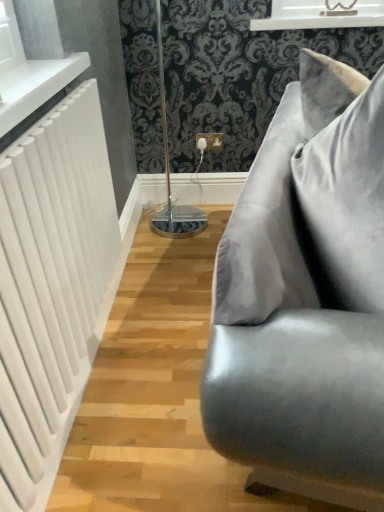
Identify the location of white glossy window frame at upper center. (321, 14).

The width and height of the screenshot is (384, 512). I want to click on white matte radiator at left, so click(x=53, y=276).

Find the location of `white glossy radiator at upper left`. white glossy radiator at upper left is located at coordinates (35, 86).

Locate an element on the screen. This screenshot has height=512, width=384. white glossy window frame at upper center is located at coordinates (321, 14).

Which object is further away from the camera taking this photo, white glossy window frame at upper center or satin gray couch at right?

white glossy window frame at upper center is further from the camera.

Which point is more forward, (313,22) or (296,269)?

The point (296,269) is closer.

From the image's perspective, is white glossy window frame at upper center over satin gray couch at right?

Yes.

What's the angular difference between white matte radiator at left and satin gray couch at right's facing directions?

The angular difference between white matte radiator at left and satin gray couch at right is 12.7 degrees.

From the picture: Does white matte radiator at left have a larger size compared to satin gray couch at right?

Actually, white matte radiator at left might be smaller than satin gray couch at right.

Considering the relative positions of white matte radiator at left and satin gray couch at right in the image provided, is white matte radiator at left to the left of satin gray couch at right from the viewer's perspective?

Yes.

From the image's perspective, which one is positioned lower, white matte radiator at left or satin gray couch at right?

satin gray couch at right.

Measure the distance from white matte radiator at left to white glossy radiator at upper left.

11.43 inches.

Considering the points (17, 194) and (32, 65), which point is behind, point (17, 194) or point (32, 65)?

The point (32, 65) is more distant.

Can you tell me how much white matte radiator at left and white glossy radiator at upper left differ in facing direction?

The angular difference between white matte radiator at left and white glossy radiator at upper left is 0.00133 degrees.

Does white matte radiator at left turn towards white glossy radiator at upper left?

No.

Is point (312, 156) positioned behind point (12, 111)?

No.

Which object is further away from the camera taking this photo, satin gray pillow at right or white glossy radiator at upper left?

white glossy radiator at upper left is behind.

Is satin gray pillow at right to the right of white glossy radiator at upper left from the viewer's perspective?

Correct, you'll find satin gray pillow at right to the right of white glossy radiator at upper left.

You are a GUI agent. You are given a task and a screenshot of the screen. Output one action in this format:
    pyautogui.click(x=<x>, y=<y>)
    Task: Click on the window sill lying above the satin gray pillow at right (from the image's perspective)
    
    Given the screenshot: What is the action you would take?
    (x=35, y=86)

From the image's perspective, which is above, satin gray couch at right or satin gray pillow at right?

satin gray pillow at right appears higher in the image.

Is satin gray couch at right touching satin gray pillow at right?

Indeed, satin gray couch at right and satin gray pillow at right are beside each other and touching.

Is satin gray couch at right wider than satin gray pillow at right?

Indeed, satin gray couch at right has a greater width compared to satin gray pillow at right.

Can you tell me how much satin gray pillow at right and white matte radiator at left differ in facing direction?

The facing directions of satin gray pillow at right and white matte radiator at left are 12.7 degrees apart.

Considering the relative positions of satin gray pillow at right and white matte radiator at left in the image provided, is satin gray pillow at right in front of white matte radiator at left?

No, satin gray pillow at right is further to the viewer.

The height and width of the screenshot is (512, 384). In order to click on pillow on the right of white matte radiator at left in this screenshot , I will do `click(344, 204)`.

From the image's perspective, between satin gray pillow at right and white matte radiator at left, which one is located above?

satin gray pillow at right is shown above in the image.

The width and height of the screenshot is (384, 512). Identify the location of studio couch to the right of satin gray pillow at right. (306, 298).

Do you think satin gray pillow at right is within satin gray couch at right, or outside of it?

satin gray pillow at right is contained in satin gray couch at right.

From the image's perspective, who appears lower, satin gray pillow at right or satin gray couch at right?

satin gray couch at right appears lower in the image.

Identify the location of studio couch below the white glossy window frame at upper center (from the image's perspective). This screenshot has width=384, height=512. (306, 298).

The width and height of the screenshot is (384, 512). What are the coordinates of `radiator lying behind the satin gray couch at right` in the screenshot? It's located at (53, 276).

Which object lies further to the anchor point white glossy radiator at upper left, white matte radiator at left or satin gray couch at right?

satin gray couch at right is positioned further to the anchor white glossy radiator at upper left.

Based on their spatial positions, is satin gray couch at right or white matte radiator at left further from white glossy radiator at upper left?

satin gray couch at right lies further to white glossy radiator at upper left than the other object.

Considering their positions, is satin gray pillow at right positioned further to satin gray couch at right than white glossy radiator at upper left?

Based on the image, white glossy radiator at upper left appears to be further to satin gray couch at right.

Which object lies nearer to the anchor point white glossy radiator at upper left, satin gray pillow at right or white glossy window frame at upper center?

satin gray pillow at right is positioned closer to the anchor white glossy radiator at upper left.

Which object lies nearer to the anchor point satin gray pillow at right, white glossy window frame at upper center or satin gray couch at right?

Based on the image, satin gray couch at right appears to be nearer to satin gray pillow at right.

Which object lies nearer to the anchor point white matte radiator at left, white glossy radiator at upper left or white glossy window frame at upper center?

white glossy radiator at upper left is positioned closer to the anchor white matte radiator at left.

From the image, which object appears to be farther from white matte radiator at left, satin gray pillow at right or satin gray couch at right?

satin gray pillow at right is further to white matte radiator at left.

When comparing their distances from white matte radiator at left, does satin gray pillow at right or white glossy window frame at upper center seem closer?

satin gray pillow at right is closer to white matte radiator at left.

Identify the location of window sill positioned between satin gray couch at right and white glossy window frame at upper center from near to far. The width and height of the screenshot is (384, 512). (35, 86).

Find the location of a particular element. This screenshot has width=384, height=512. window sill between white matte radiator at left and white glossy window frame at upper center along the z-axis is located at coordinates (35, 86).

Where is `radiator between white glossy radiator at upper left and satin gray pillow at right`? radiator between white glossy radiator at upper left and satin gray pillow at right is located at coordinates (53, 276).

Where is `pillow situated between white glossy radiator at upper left and satin gray couch at right from left to right`? The width and height of the screenshot is (384, 512). pillow situated between white glossy radiator at upper left and satin gray couch at right from left to right is located at coordinates (344, 204).